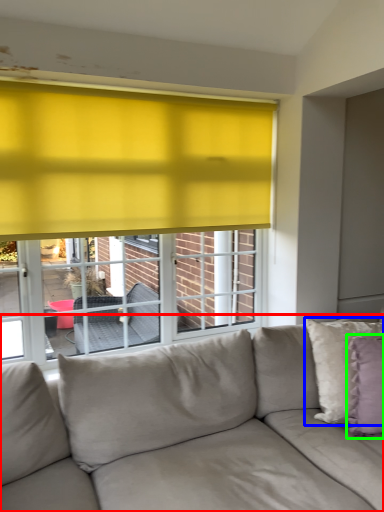
Question: Which is nearer to the studio couch (highlighted by a red box)? pillow (highlighted by a blue box) or pillow (highlighted by a green box).

Choices:
 (A) pillow
 (B) pillow

Answer: (A)